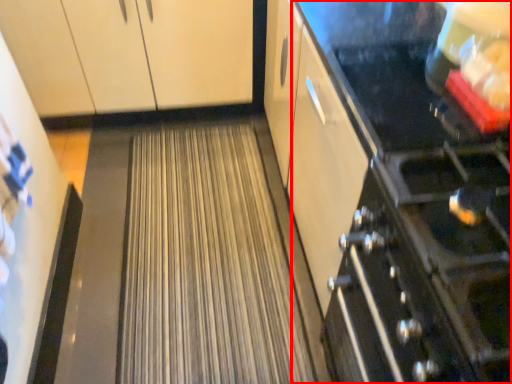
Question: From the image, what is the correct spatial relationship of appliance (annotated by the red box) in relation to cabinetry?

Choices:
 (A) right
 (B) left

Answer: (A)